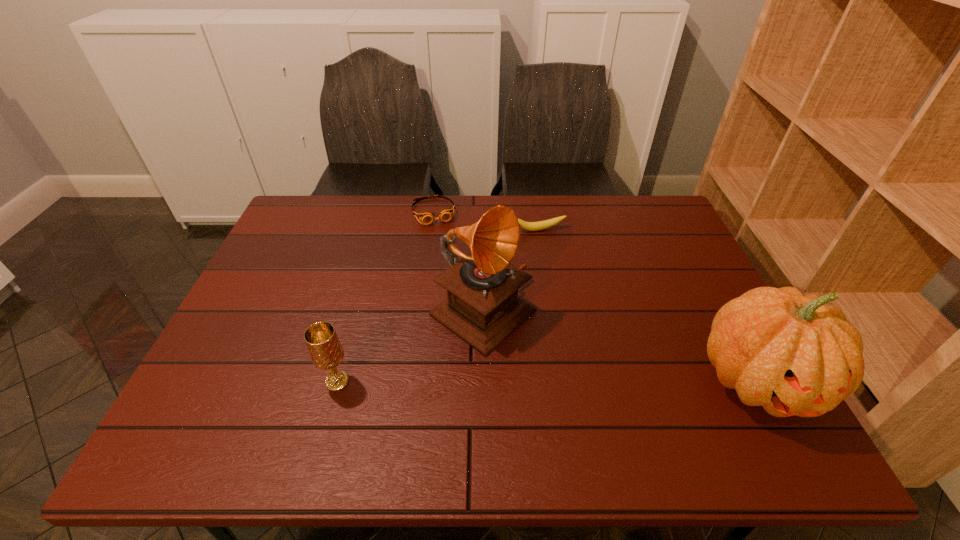
Identify the location of chalice. This screenshot has height=540, width=960. (326, 352).

Where is `the third shortest object`? the third shortest object is located at coordinates (326, 352).

The image size is (960, 540). I want to click on the rightmost object, so click(793, 355).

Where is `pumpkin`? Image resolution: width=960 pixels, height=540 pixels. pumpkin is located at coordinates (793, 355).

Locate an element on the screen. The width and height of the screenshot is (960, 540). the tallest object is located at coordinates (482, 308).

The height and width of the screenshot is (540, 960). I want to click on banana, so click(x=540, y=225).

You are a GUI agent. You are given a task and a screenshot of the screen. Output one action in this format:
    pyautogui.click(x=<x>, y=<y>)
    Task: Click on the goggles
    The image size is (960, 540).
    Given the screenshot: What is the action you would take?
    pyautogui.click(x=426, y=217)

Locate an element on the screen. The height and width of the screenshot is (540, 960). vacant space situated 0.180m on the left of the chalice is located at coordinates (243, 381).

Identify the location of vacant point located on the horn of the tallest object. (607, 398).

Find the location of a particular element. The image size is (960, 540). vacant region located on the horn of the tallest object is located at coordinates (603, 395).